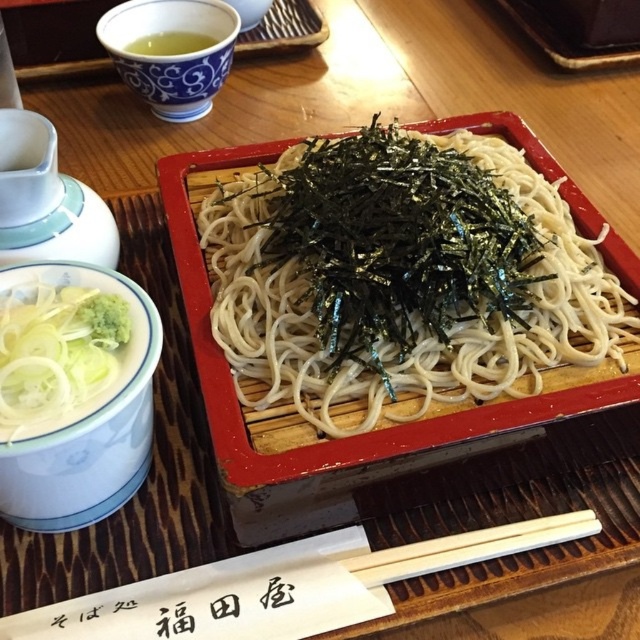
You are a guest at a Japanese meal and need to use the white wood chopsticks at center to pick up the green liquid at upper left. Is it possible to reach them without moving anything else?

The white wood chopsticks at center is located below the green liquid at upper left, so you can reach the green liquid at upper left with the white wood chopsticks at center without moving anything else.

You are a guest at a Japanese meal and need to reach for the white ceramic bowl at lower left and the porcelain cup at upper left. Which one is closer to your left side?

The porcelain cup at upper left is closer to your left side because the white ceramic bowl at lower left is to the right of it.

You are a guest at a Japanese meal and need to reach for the white wood chopsticks at lower center to eat the white matte noodles at center. Based on their positions, will you need to move your hand upwards or downwards to pick up the chopsticks?

The white matte noodles at center is above the white wood chopsticks at lower center, so you will need to move your hand downwards to pick up the chopsticks.